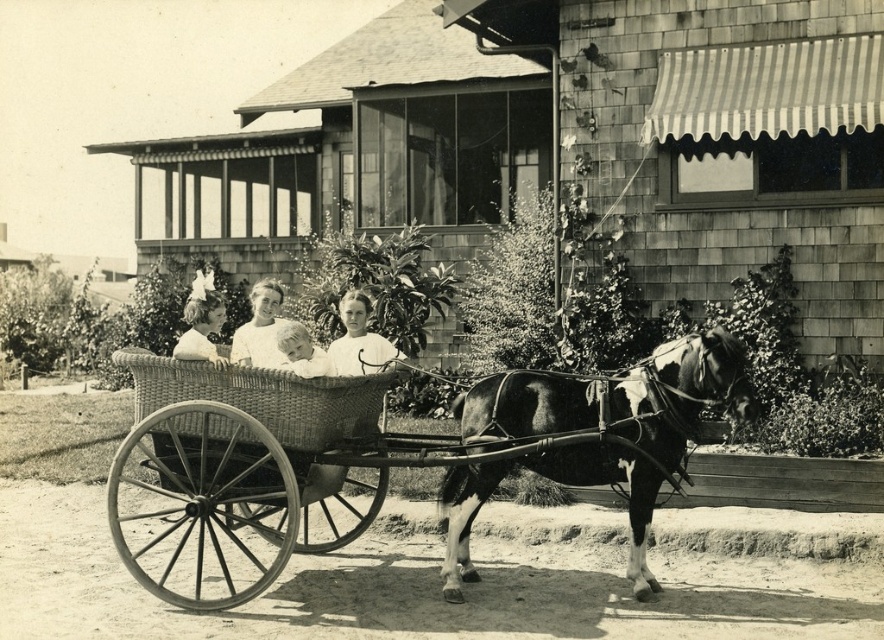
Is woven wicker basket at center to the left of smooth white shirt at center from the viewer's perspective?

Yes, woven wicker basket at center is to the left of smooth white shirt at center.

Who is more distant from viewer, (277, 440) or (286, 332)?

The point (277, 440) is more distant.

Consider the image. Who is more distant from viewer, (329, 390) or (310, 365)?

The point (329, 390) is behind.

At what (x,y) coordinates should I click in order to perform the action: click on woven wicker basket at center. Please return your answer as a coordinate pair (x, y). Looking at the image, I should click on (263, 397).

Does black and white horse at center have a lesser width compared to white cotton dress at center?

Indeed, black and white horse at center has a lesser width compared to white cotton dress at center.

Does black and white horse at center have a greater height compared to white cotton dress at center?

Yes.

Is point (575, 470) closer to camera compared to point (273, 312)?

Yes, it is.

Identify the location of black and white horse at center. The height and width of the screenshot is (640, 884). (618, 397).

Is point (246, 333) closer to viewer compared to point (302, 372)?

No, it is not.

Can you confirm if white cotton dress at center is smaller than smooth white shirt at center?

Actually, white cotton dress at center might be larger than smooth white shirt at center.

Where is `white cotton dress at center`? This screenshot has height=640, width=884. white cotton dress at center is located at coordinates (260, 328).

Locate an element on the screen. Image resolution: width=884 pixels, height=640 pixels. white cotton dress at center is located at coordinates (260, 328).